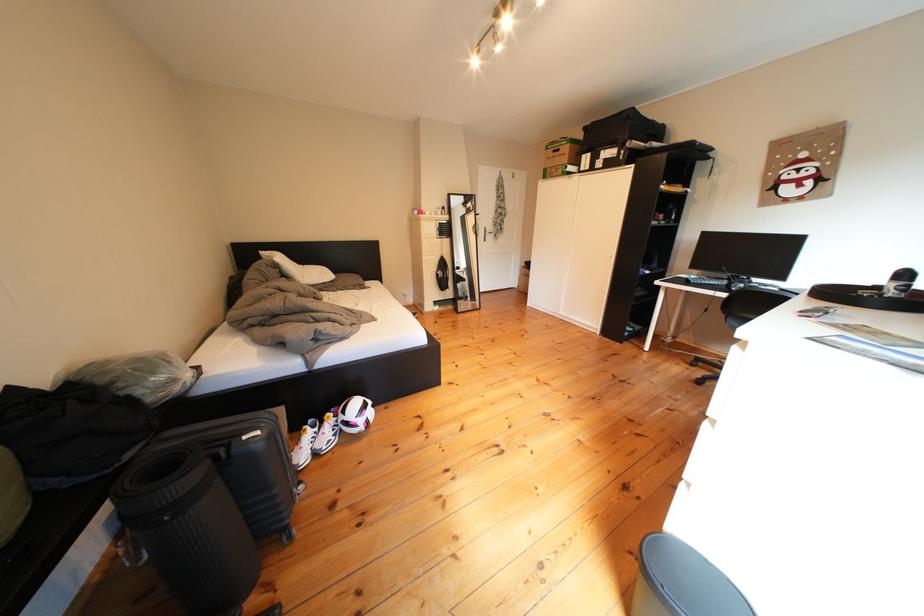
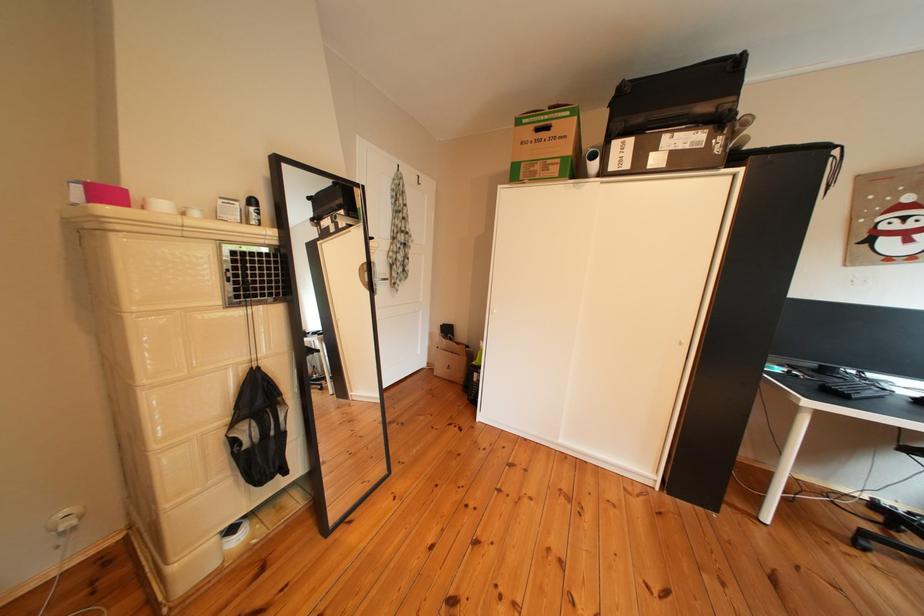
Find the pixel in the second image that matches (x=434, y=217) in the first image.

(123, 199)